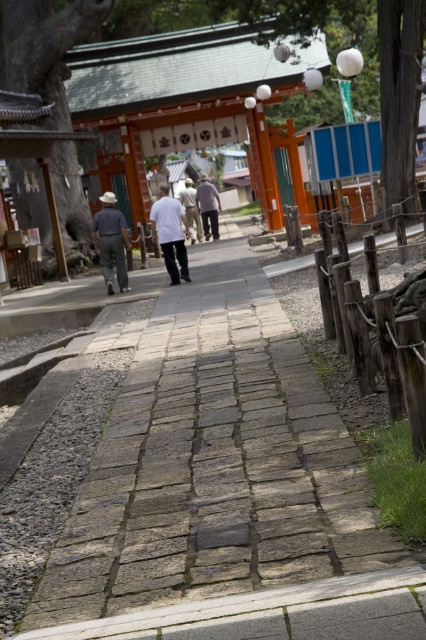
You are a tourist walking along the pathway and notice the rustic wooden fence at right and the light gray cotton pants at center. Which object appears smaller in the image?

The rustic wooden fence at right appears smaller compared to the light gray cotton pants at center.

You are standing on the pathway and notice the rustic wooden fence at right and the light gray cotton pants at center. Which object is positioned lower in the image?

The rustic wooden fence at right is positioned lower than the light gray cotton pants at center in the image.

You are a traveler walking along the pathway towards the torii gate. You notice a denim jacket at left and a white matte shirt at center. Which clothing item is smaller in size?

The denim jacket at left is smaller in size compared to the white matte shirt at center.